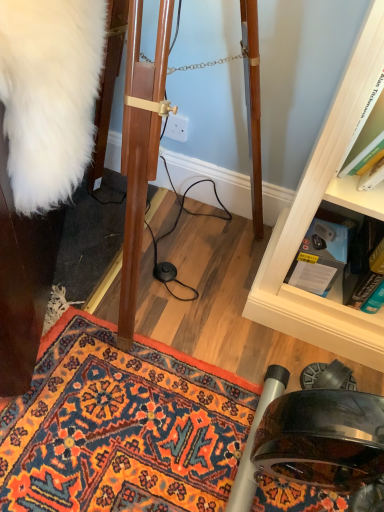
Question: Is blue cardboard box at lower right, acting as the second book starting from the right, at the right side of white fluffy coat at left?

Choices:
 (A) no
 (B) yes

Answer: (B)

Question: Can you see blue cardboard box at lower right, marked as the 1th book in a left-to-right arrangement, touching white fluffy coat at left?

Choices:
 (A) no
 (B) yes

Answer: (A)

Question: Considering the relative sizes of blue cardboard box at lower right, acting as the second book starting from the right, and white fluffy coat at left in the image provided, is blue cardboard box at lower right, acting as the second book starting from the right, taller than white fluffy coat at left?

Choices:
 (A) no
 (B) yes

Answer: (A)

Question: From a real-world perspective, is blue cardboard box at lower right, marked as the 1th book in a left-to-right arrangement, located higher than white fluffy coat at left?

Choices:
 (A) no
 (B) yes

Answer: (A)

Question: From the image's perspective, would you say blue cardboard box at lower right, acting as the second book starting from the right, is positioned over white fluffy coat at left?

Choices:
 (A) no
 (B) yes

Answer: (A)

Question: From a real-world perspective, is blue cardboard box at lower right, acting as the second book starting from the right, positioned under white fluffy coat at left based on gravity?

Choices:
 (A) yes
 (B) no

Answer: (A)

Question: Does white fluffy coat at left appear on the left side of carpeted doormat at lower left?

Choices:
 (A) yes
 (B) no

Answer: (A)

Question: From the image's perspective, is white fluffy coat at left located above carpeted doormat at lower left?

Choices:
 (A) yes
 (B) no

Answer: (A)

Question: Considering the relative positions of white fluffy coat at left and carpeted doormat at lower left in the image provided, is white fluffy coat at left behind carpeted doormat at lower left?

Choices:
 (A) no
 (B) yes

Answer: (A)

Question: Can you confirm if white fluffy coat at left is shorter than carpeted doormat at lower left?

Choices:
 (A) no
 (B) yes

Answer: (A)

Question: Are white fluffy coat at left and carpeted doormat at lower left located far from each other?

Choices:
 (A) yes
 (B) no

Answer: (B)

Question: Is white fluffy coat at left taller than carpeted doormat at lower left?

Choices:
 (A) yes
 (B) no

Answer: (A)

Question: Considering the relative positions of carpeted doormat at lower left and white fluffy coat at left in the image provided, is carpeted doormat at lower left to the left of white fluffy coat at left from the viewer's perspective?

Choices:
 (A) yes
 (B) no

Answer: (B)